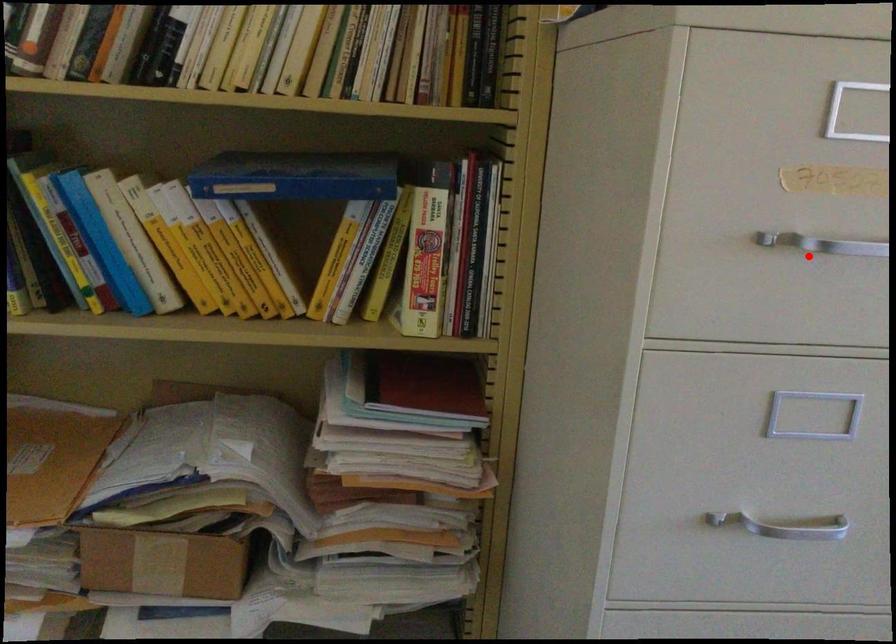
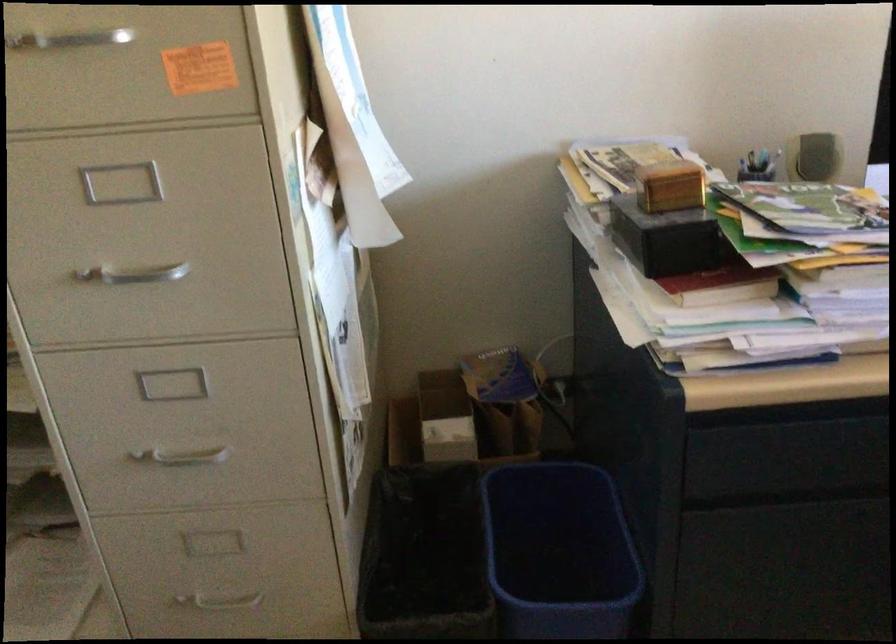
Question: A red point is marked in image1. In image2, is the corresponding 3D point closer to the camera or farther? Reply with the corresponding letter.

Choices:
 (A) The corresponding 3D point is closer.
 (B) The corresponding 3D point is farther.

Answer: (B)